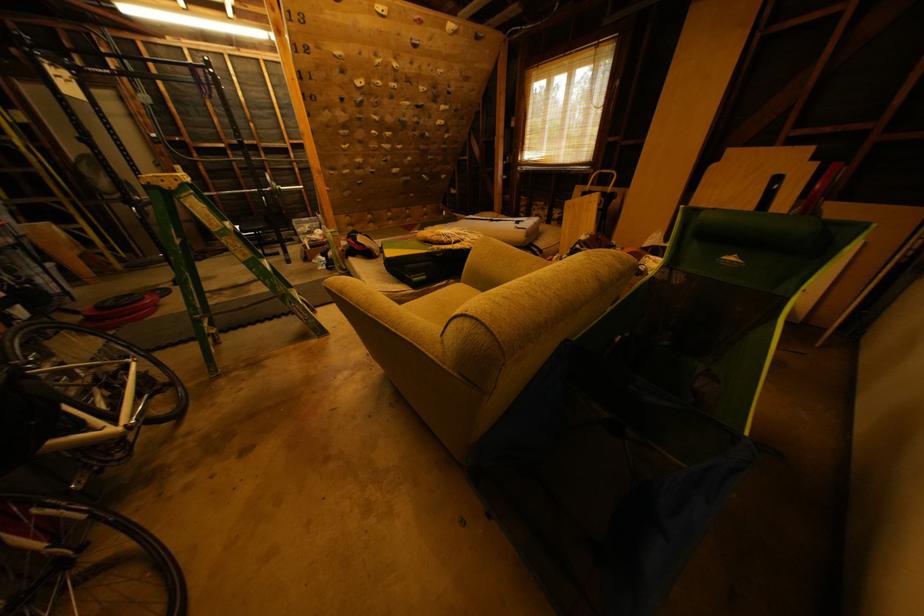
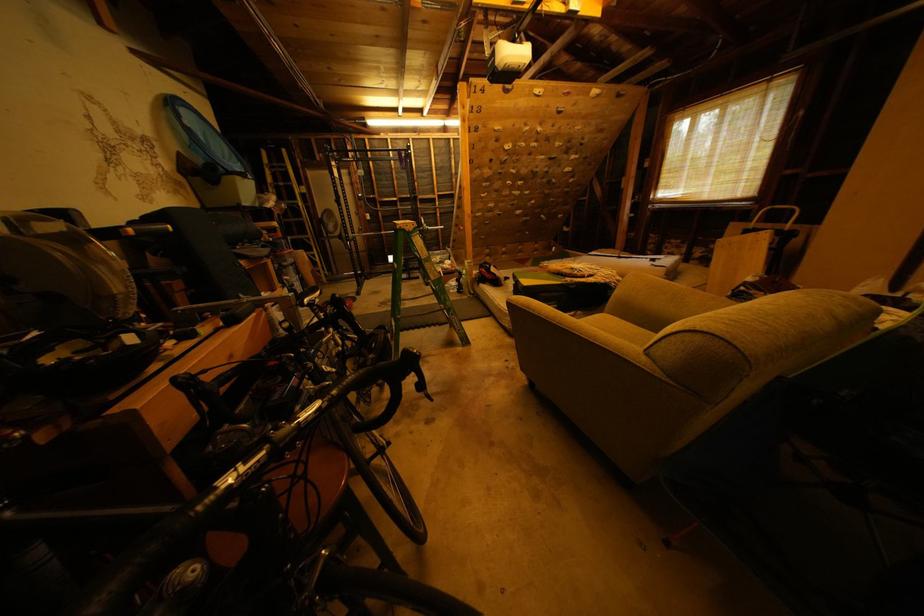
Based on the photo, in a continuous first-person perspective shot, in which direction is the camera moving?

The cameraman moved toward left, backward.